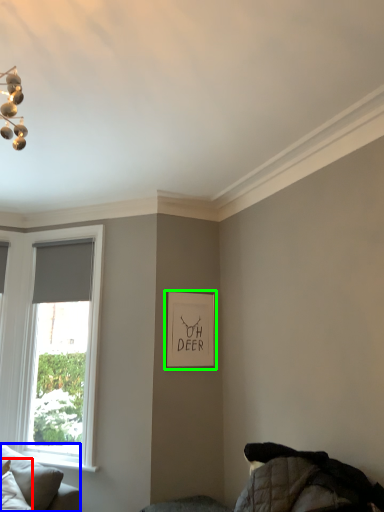
Question: Estimate the real-world distances between objects in this image. Which object is farther from pillow (highlighted by a red box), studio couch (highlighted by a blue box) or picture frame (highlighted by a green box)?

Choices:
 (A) studio couch
 (B) picture frame

Answer: (B)